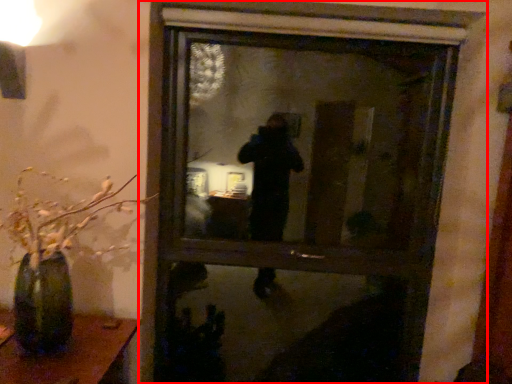
Question: Where is window (annotated by the red box) located in relation to houseplant in the image?

Choices:
 (A) right
 (B) left

Answer: (A)